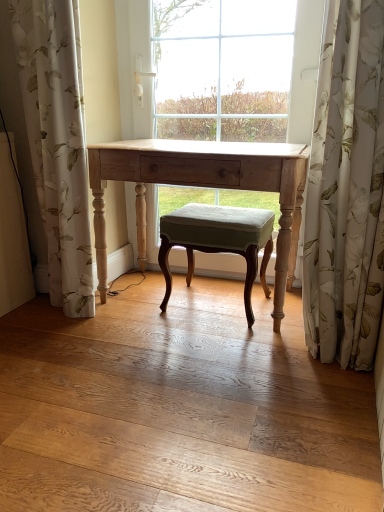
Locate an element on the screen. This screenshot has width=384, height=512. vacant region in front of white floral fabric at right, which appears as the 1th curtain when viewed from the right is located at coordinates (336, 387).